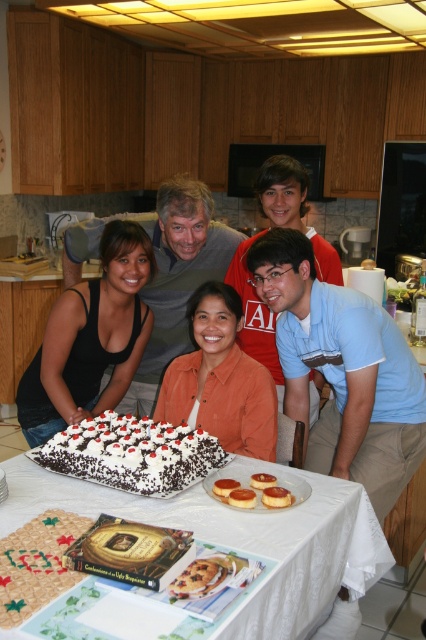
Question: Which point appears closest to the camera in this image?

Choices:
 (A) (195, 241)
 (B) (267, 492)

Answer: (B)

Question: Does orange matte shirt at center appear on the left side of red shirt at center?

Choices:
 (A) no
 (B) yes

Answer: (B)

Question: Can you confirm if orange matte shirt at center is thinner than golden brown caramel custard tarts at center?

Choices:
 (A) yes
 (B) no

Answer: (B)

Question: Which point is farther from the camera taking this photo?

Choices:
 (A) (126, 452)
 (B) (155, 378)
 (C) (253, 301)

Answer: (B)

Question: Is white cloth table at center below matte black shirt at center?

Choices:
 (A) yes
 (B) no

Answer: (A)

Question: Estimate the real-world distances between objects in this image. Which object is closer to the red shirt at center?

Choices:
 (A) white frosted cake at center
 (B) white cloth table at center
 (C) golden brown caramel custard tarts at center
 (D) black fabric at center

Answer: (D)